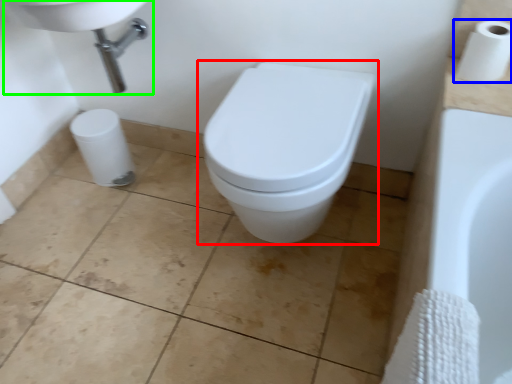
Question: Based on their relative distances, which object is farther from toilet (highlighted by a red box)? Choose from toilet paper (highlighted by a blue box) and sink (highlighted by a green box).

Choices:
 (A) toilet paper
 (B) sink

Answer: (B)